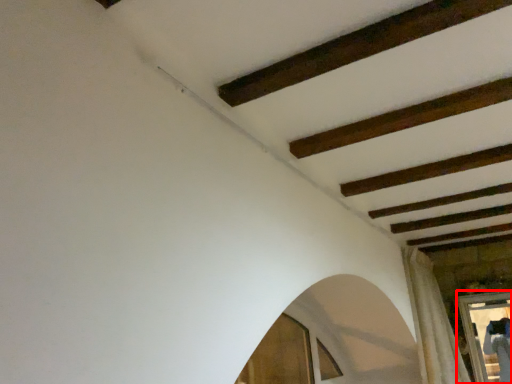
Question: From the image's perspective, where is window frame (annotated by the red box) located relative to curtain?

Choices:
 (A) above
 (B) below

Answer: (B)